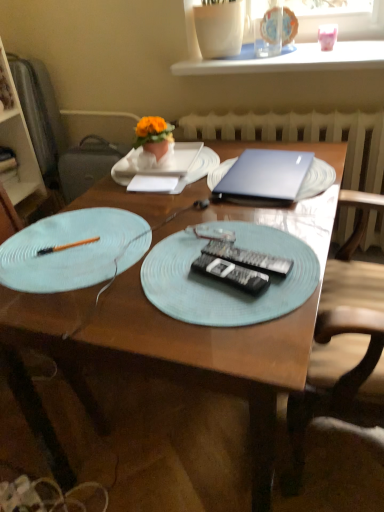
In order to click on empty space that is ontop of sleek metallic laptop at upper right (from a real-world perspective) in this screenshot , I will do `click(254, 165)`.